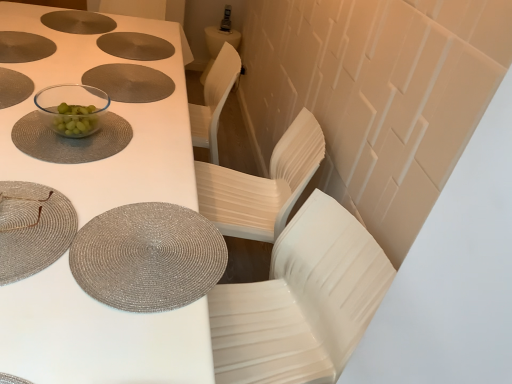
This screenshot has height=384, width=512. In order to click on vacant space positioned to the left of transparent glass bowl at center, which appears as the 2th tableware when viewed from the back in this screenshot , I will do `click(27, 112)`.